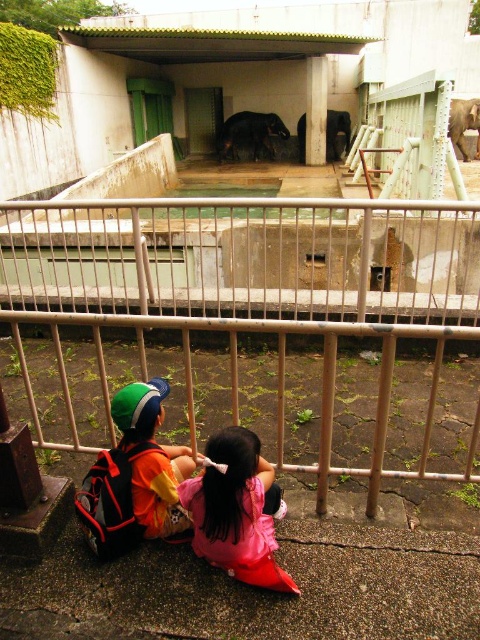
You are a parent trying to ensure your child can see the gray textured elephant at upper right without moving from their current position. Given that the matte green cap at lower left is worn by your child, can the child see the elephant over the cap?

The matte green cap at lower left is not as tall as the gray textured elephant at upper right, so the child can see the elephant over the cap since the cap is shorter than the elephant.

You are a zoo visitor standing at the railing between the two children and the elephant enclosure. You notice two points marked in the scene. The first point is at coordinates point (278, 138) and the second is at point (458, 140). Which point is closer to you?

Point (278, 138) is closer to you because it is further to the camera than point (458, 140).